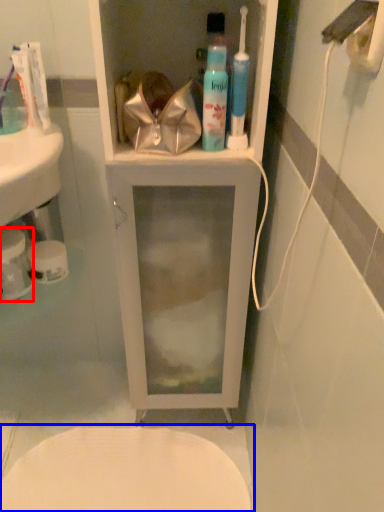
Question: Which object appears closest to the camera in this image, toilet paper (highlighted by a red box) or toilet (highlighted by a blue box)?

Choices:
 (A) toilet paper
 (B) toilet

Answer: (A)